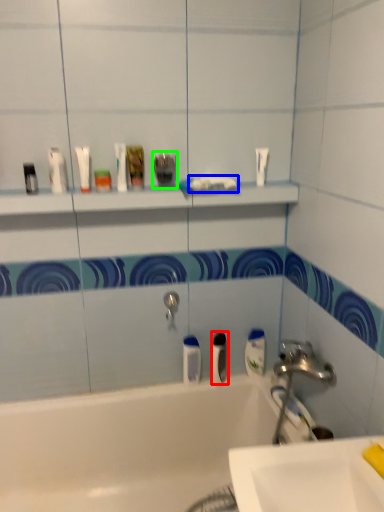
Question: Considering the real-world distances, which object is farthest from mouthwash (highlighted by a red box)? toothpaste (highlighted by a blue box) or toiletry (highlighted by a green box)?

Choices:
 (A) toothpaste
 (B) toiletry

Answer: (B)